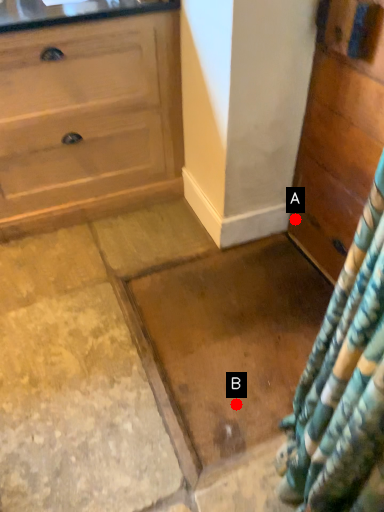
Question: Two points are circled on the image, labeled by A and B beside each circle. Which of the following is the closest to the observer?

Choices:
 (A) A is closer
 (B) B is closer

Answer: (B)